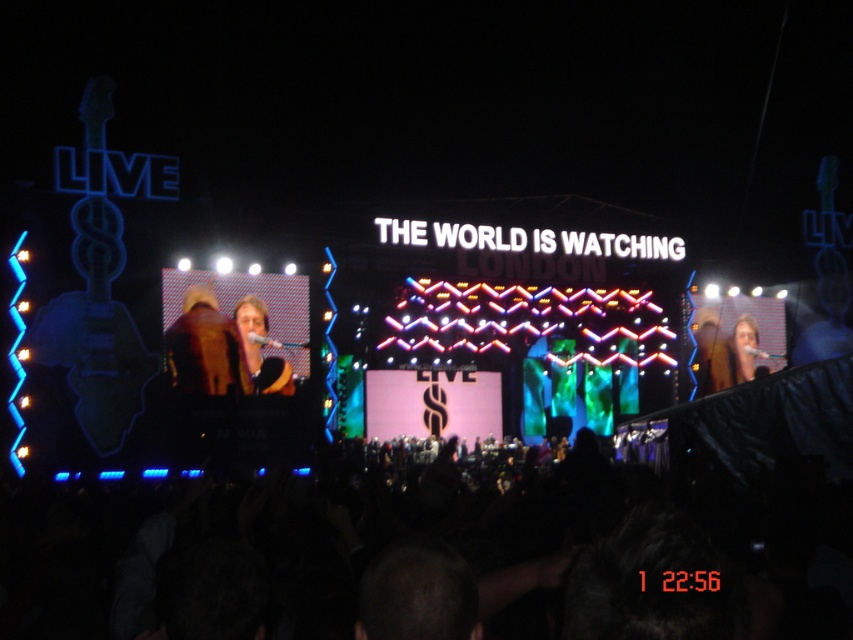
Question: Is brown leather jacket at center to the left of light brown leather jacket at center from the viewer's perspective?

Choices:
 (A) yes
 (B) no

Answer: (A)

Question: Which object appears farthest from the camera in this image?

Choices:
 (A) light brown leather jacket at center
 (B) brown leather jacket at center
 (C) smooth skin face at right

Answer: (C)

Question: Is light brown leather jacket at center to the right of smooth skin face at right from the viewer's perspective?

Choices:
 (A) no
 (B) yes

Answer: (A)

Question: Which of the following is the closest to the observer?

Choices:
 (A) light brown leather jacket at center
 (B) smooth skin face at right

Answer: (A)

Question: Is light brown leather jacket at center below smooth skin face at right?

Choices:
 (A) no
 (B) yes

Answer: (A)

Question: Among these points, which one is farthest from the camera?

Choices:
 (A) (724, 352)
 (B) (169, 346)

Answer: (A)